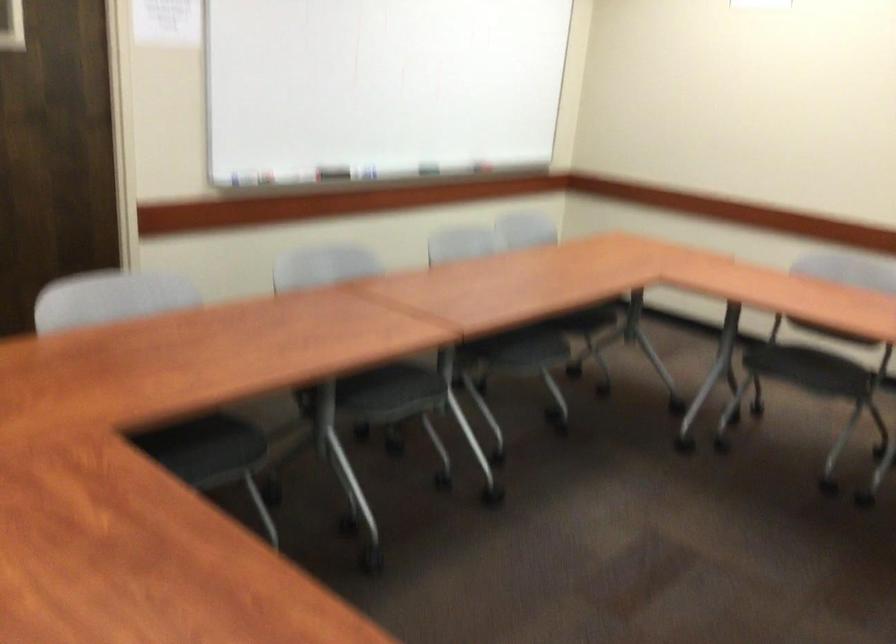
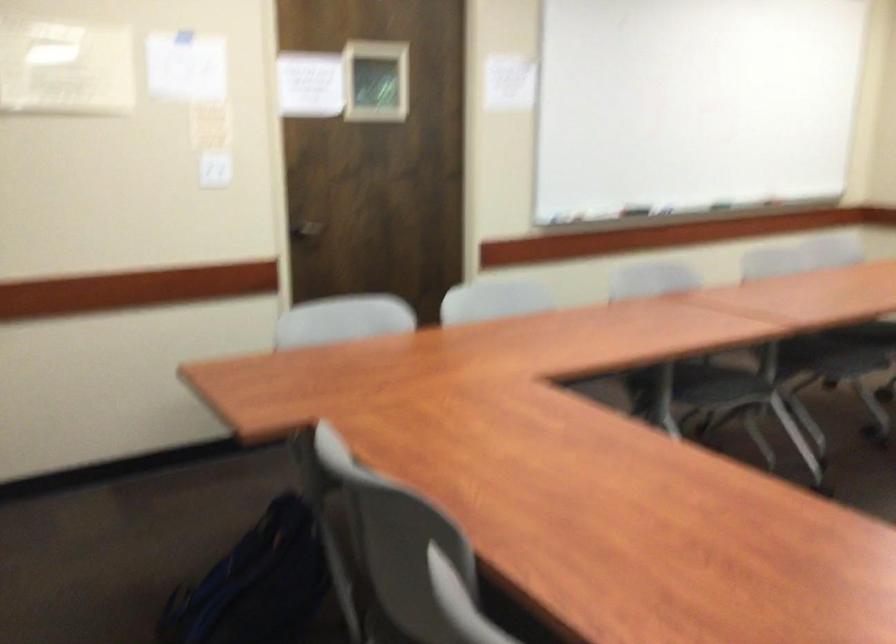
Locate, in the second image, the point that corresponds to the point at 374,398 in the first image.

(712, 386)